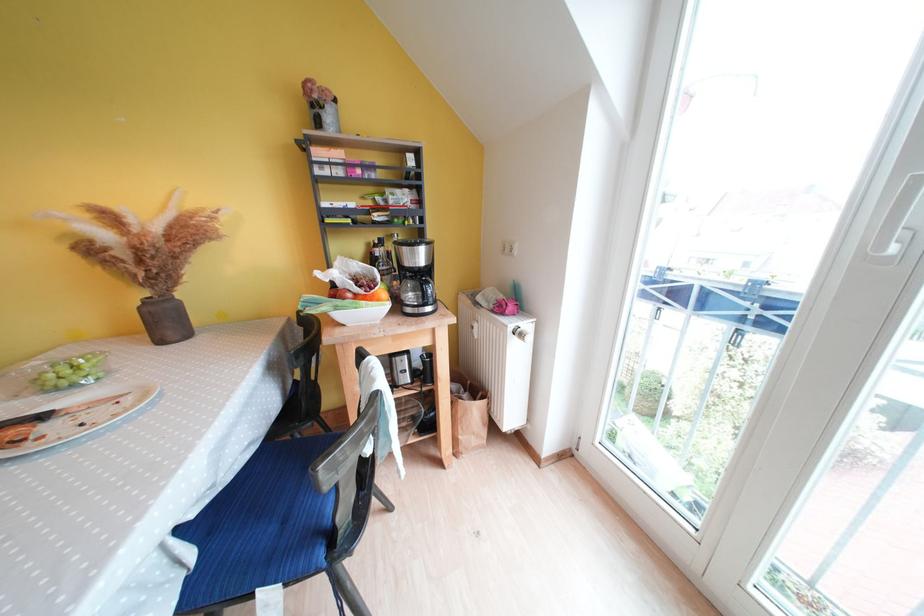
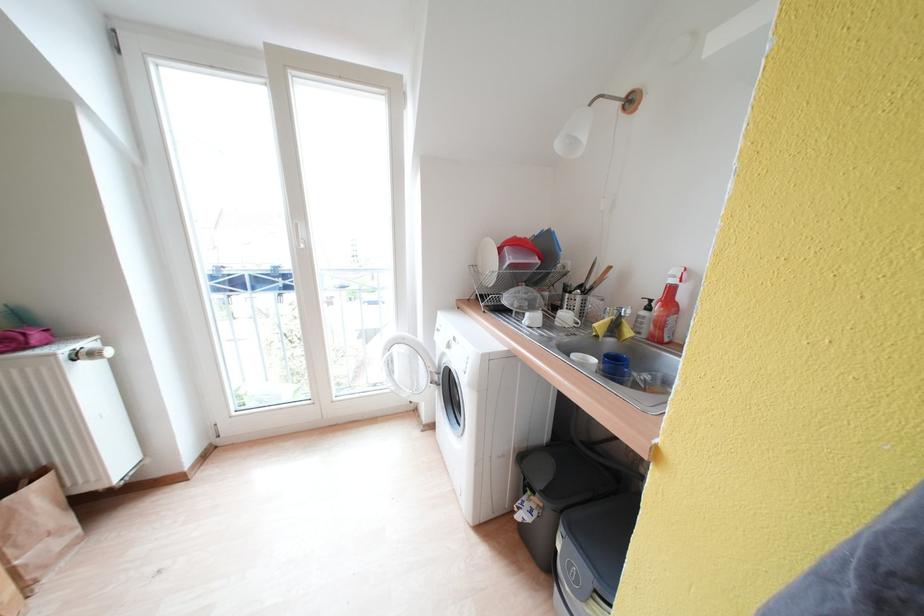
Where in the second image is the point corresponding to [487,398] from the first image?

(30, 485)